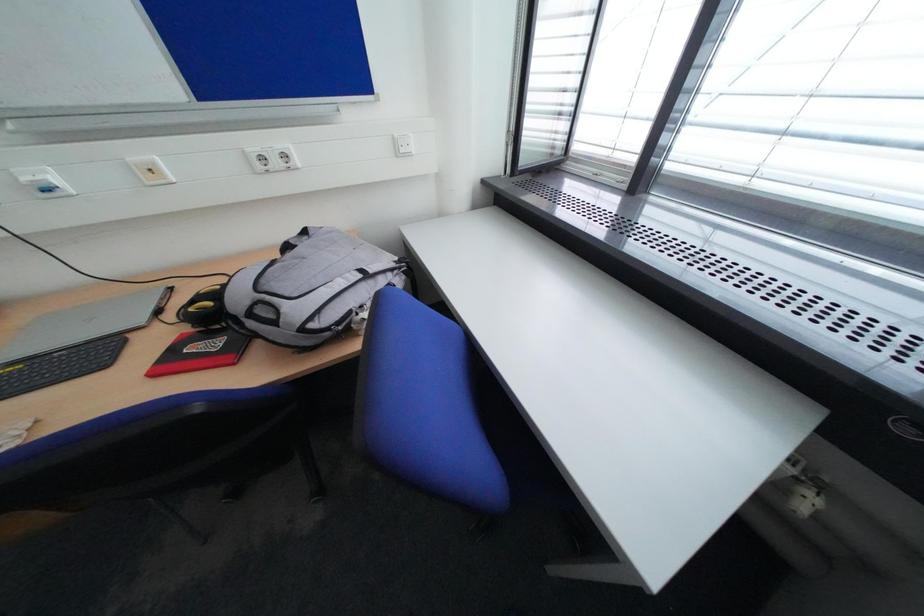
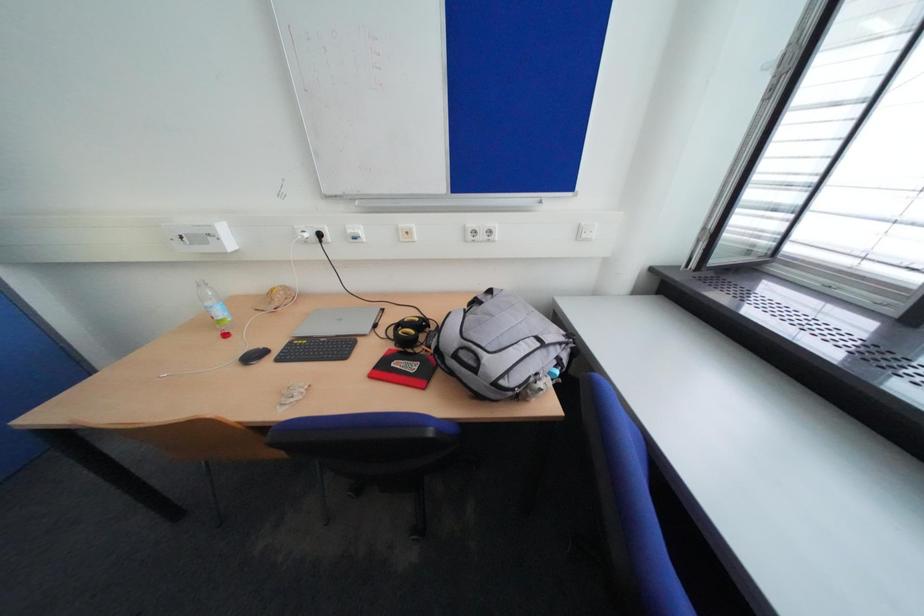
Question: The images are taken continuously from a first-person perspective. In which direction are you moving?

Choices:
 (A) Left
 (B) Right
 (C) Forward
 (D) Backward

Answer: (A)